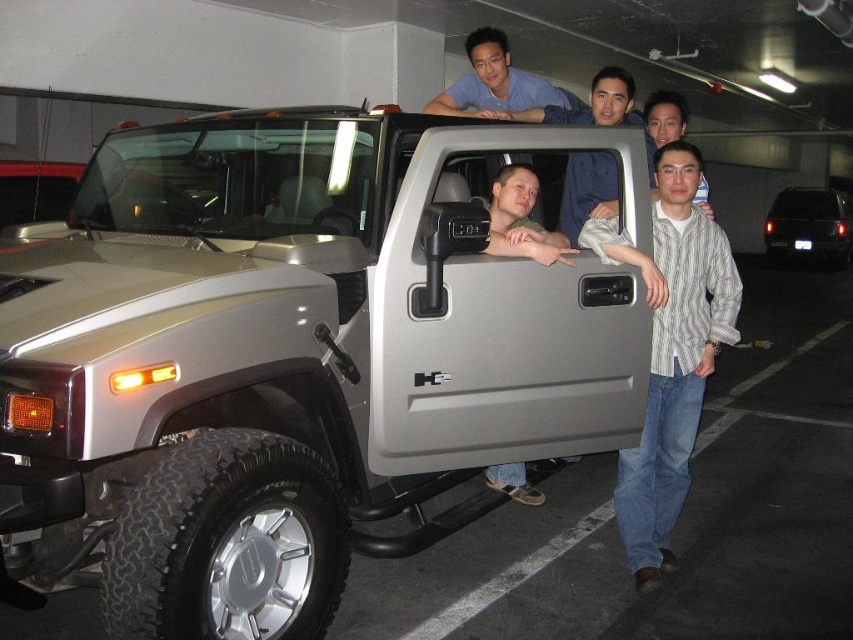
Question: Which point is closer to the camera taking this photo?

Choices:
 (A) (834, 205)
 (B) (605, 113)
 (C) (480, 52)

Answer: (B)

Question: Does matte gray shirt at center appear on the right side of matte gray door at center?

Choices:
 (A) yes
 (B) no

Answer: (A)

Question: From the image, what is the correct spatial relationship of satin silver jeep at center in relation to black glossy suv at right?

Choices:
 (A) right
 (B) left

Answer: (B)

Question: Can you confirm if striped cotton shirt at center is positioned to the left of matte gray shirt at center?

Choices:
 (A) yes
 (B) no

Answer: (B)

Question: Which point appears farthest from the camera in this image?

Choices:
 (A) (12, 298)
 (B) (842, 243)

Answer: (B)

Question: Among these objects, which one is nearest to the camera?

Choices:
 (A) matte blue shirt at upper center
 (B) matte gray shirt at center
 (C) striped cotton shirt at center

Answer: (C)